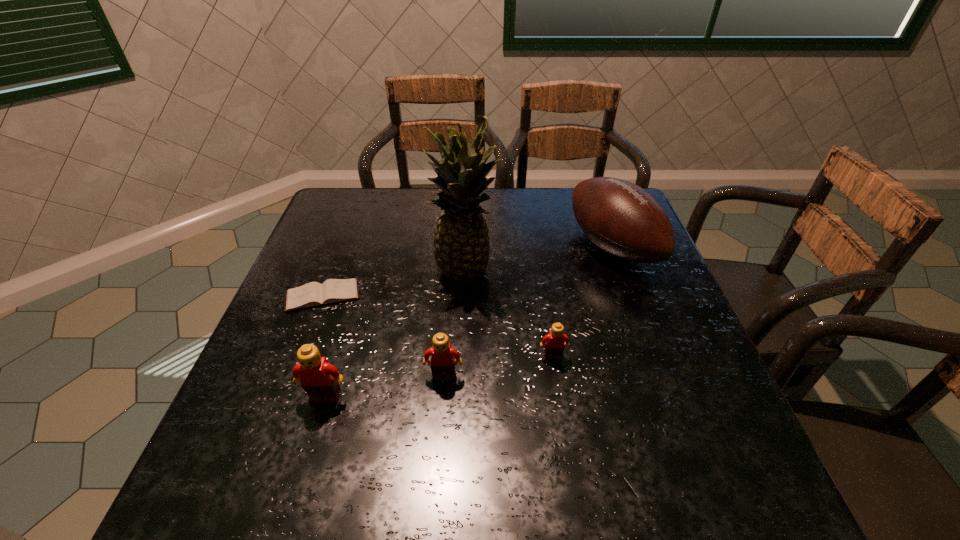
This screenshot has width=960, height=540. What are the coordinates of `the leftmost Lego` in the screenshot? It's located at (319, 379).

Locate an element on the screen. the tallest Lego is located at coordinates (319, 379).

The height and width of the screenshot is (540, 960). In order to click on the second nearest object in this screenshot , I will do `click(442, 354)`.

Where is `the second shortest Lego`? The height and width of the screenshot is (540, 960). the second shortest Lego is located at coordinates (442, 354).

Image resolution: width=960 pixels, height=540 pixels. I want to click on the shortest Lego, so click(x=553, y=343).

Identify the location of the fourth farthest object. (553, 343).

The height and width of the screenshot is (540, 960). Find the location of `football (American)`. football (American) is located at coordinates (622, 219).

Locate an element on the screen. the fifth shortest object is located at coordinates (622, 219).

Find the location of a particular element. the tallest object is located at coordinates (461, 243).

Find the location of `diary`. diary is located at coordinates (313, 294).